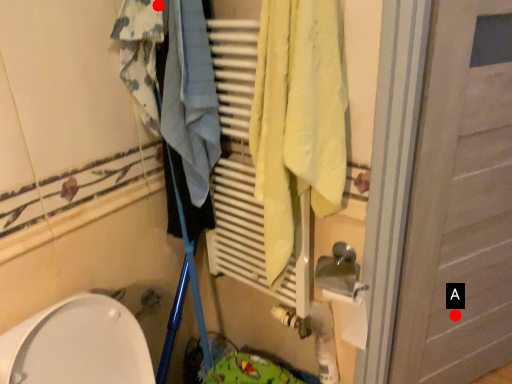
Question: Two points are circled on the image, labeled by A and B beside each circle. Which point is farther from the camera taking this photo?

Choices:
 (A) A is further
 (B) B is further

Answer: (A)